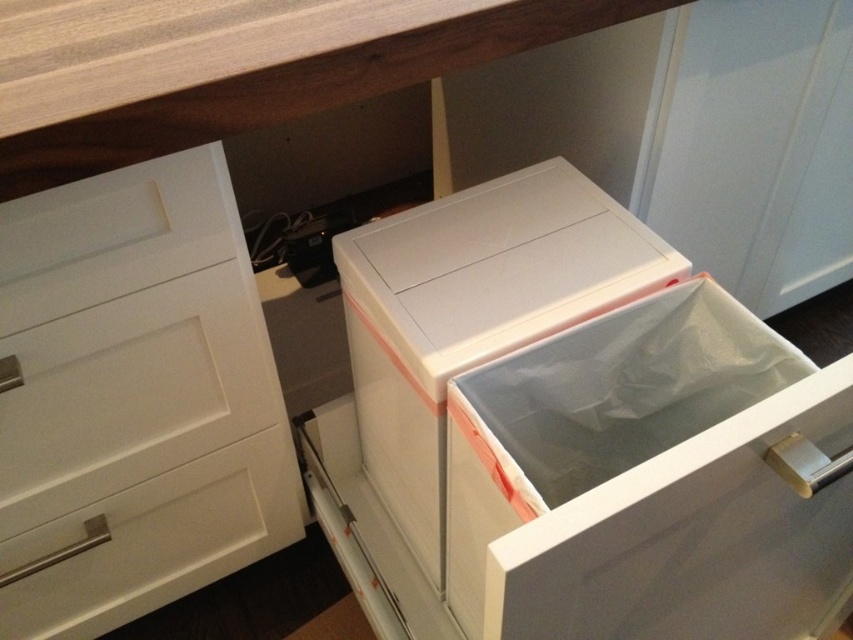
Question: Can you confirm if white plastic file cabinet at center is smaller than wooden countertop at upper center?

Choices:
 (A) no
 (B) yes

Answer: (A)

Question: Is white plastic file cabinet at center wider than white matte drawer at left?

Choices:
 (A) yes
 (B) no

Answer: (A)

Question: Which of the following is the closest to the observer?

Choices:
 (A) (399, 29)
 (B) (767, 417)

Answer: (B)

Question: Which object is positioned farthest from the white plastic file cabinet at center?

Choices:
 (A) wooden countertop at upper center
 (B) white matte drawer at left

Answer: (A)

Question: Is white plastic file cabinet at center in front of white matte drawer at left?

Choices:
 (A) yes
 (B) no

Answer: (A)

Question: Which of these objects is positioned farthest from the white plastic file cabinet at center?

Choices:
 (A) white matte drawer at left
 (B) wooden countertop at upper center

Answer: (B)